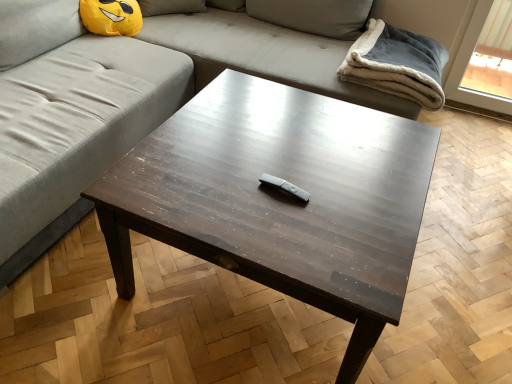
Locate an element on the screen. The image size is (512, 384). free point behind gray matte wii remote at center is located at coordinates (284, 159).